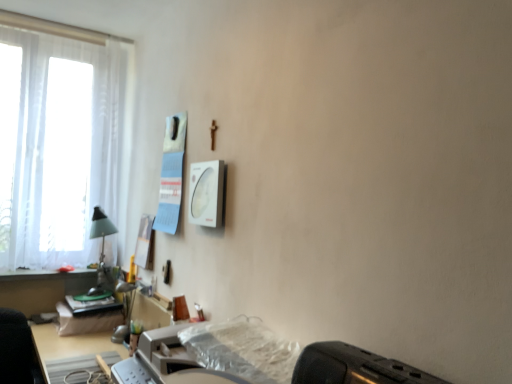
Question: Looking at their shapes, would you say transparent plastic sheet at lower center is wider or thinner than black plastic toaster at lower right?

Choices:
 (A) thin
 (B) wide

Answer: (B)

Question: Considering the positions of transparent plastic sheet at lower center and black plastic toaster at lower right in the image, is transparent plastic sheet at lower center bigger or smaller than black plastic toaster at lower right?

Choices:
 (A) small
 (B) big

Answer: (A)

Question: Which is farther from the transparent plastic sheet at lower center?

Choices:
 (A) white sheer curtain at left
 (B) black plastic toaster at lower right
 (C) translucent plastic printer at lower center

Answer: (A)

Question: Based on their relative distances, which object is farther from the transparent plastic sheet at lower center?

Choices:
 (A) black plastic toaster at lower right
 (B) white sheer curtain at left
 (C) translucent plastic printer at lower center

Answer: (B)